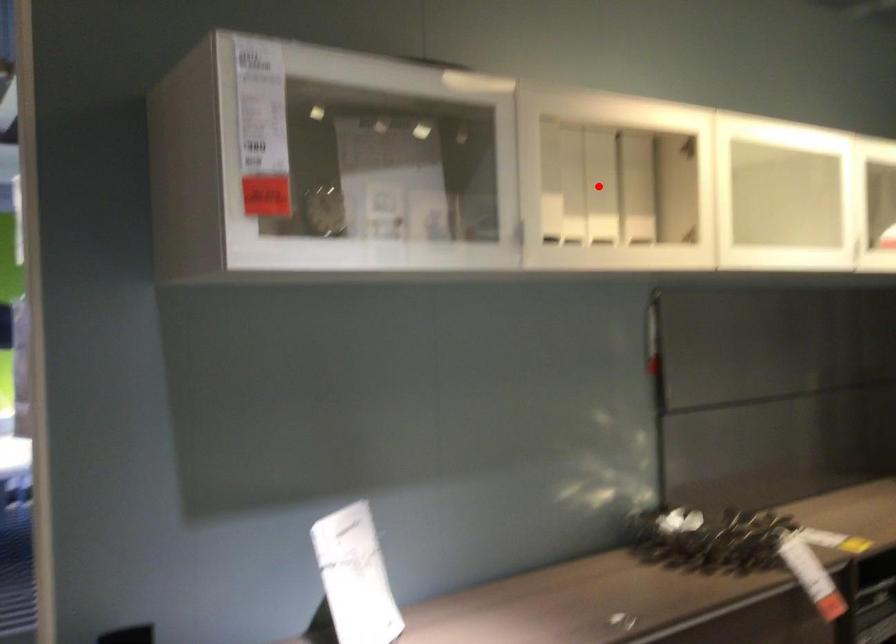
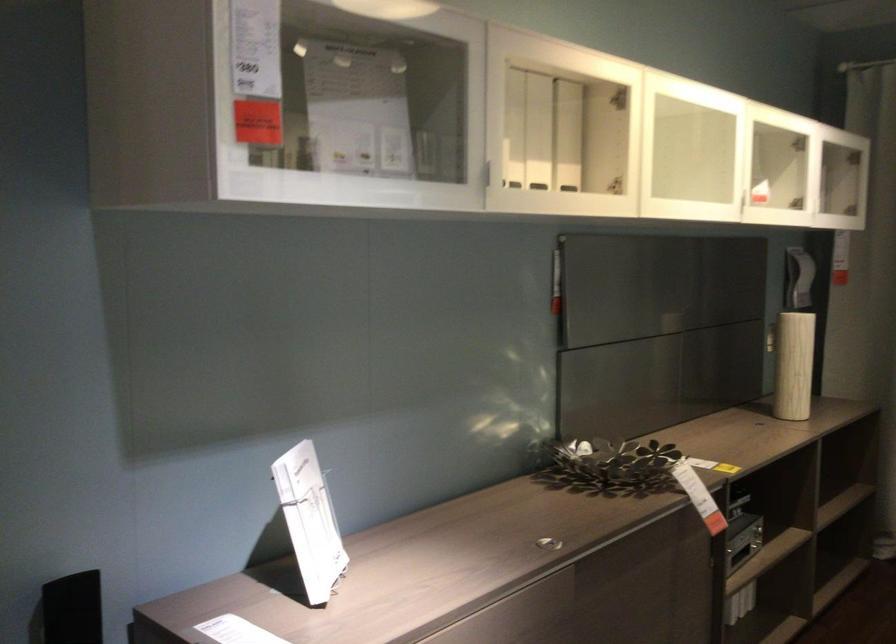
Question: I am providing you with two images of the same scene from different viewpoints. A red point is marked on the first image. Can you still see the location of the red point in image 2?

Choices:
 (A) Yes
 (B) No

Answer: (A)